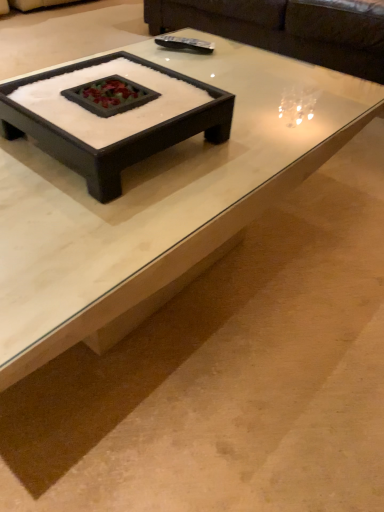
The image size is (384, 512). Identify the location of free space in front of black matte tray at center, placed as the 1th coffee table when sorted from back to front. (94, 224).